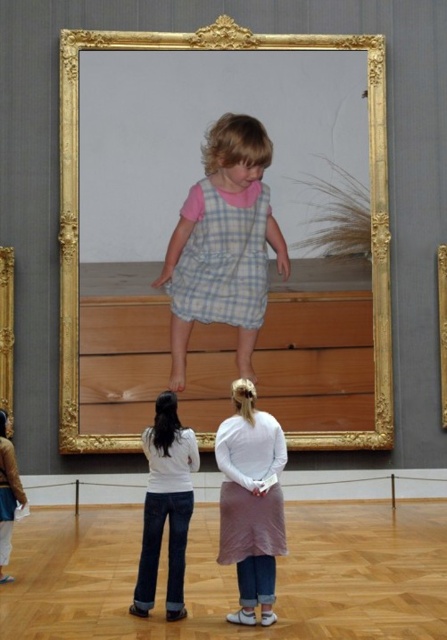
Between point (213, 236) and point (236, 426), which one is positioned in front?

Point (213, 236) is more forward.

Who is more distant from viewer, [189,200] or [233,420]?

The point [189,200] is behind.

Is point (273, 227) in front of point (227, 490)?

No.

At what (x,y) coordinates should I click in order to perform the action: click on light blue plaid dress at center. Please return your answer as a coordinate pair (x, y). The width and height of the screenshot is (447, 640). Looking at the image, I should click on (223, 243).

Is the position of checkered fabric dress at center less distant than that of pink fabric dress at lower center?

No, it is behind pink fabric dress at lower center.

Which is behind, point (222, 244) or point (231, 422)?

Point (231, 422)

At what (x,y) coordinates should I click in order to perform the action: click on checkered fabric dress at center. Please return your answer as a coordinate pair (x, y). The width and height of the screenshot is (447, 640). Looking at the image, I should click on (223, 257).

Does point (282, 516) come farther from viewer compared to point (445, 244)?

No, (282, 516) is in front of (445, 244).

What do you see at coordinates (249, 486) in the screenshot? The height and width of the screenshot is (640, 447). I see `pink fabric dress at lower center` at bounding box center [249, 486].

Where is `pink fabric dress at lower center`? This screenshot has width=447, height=640. pink fabric dress at lower center is located at coordinates (249, 486).